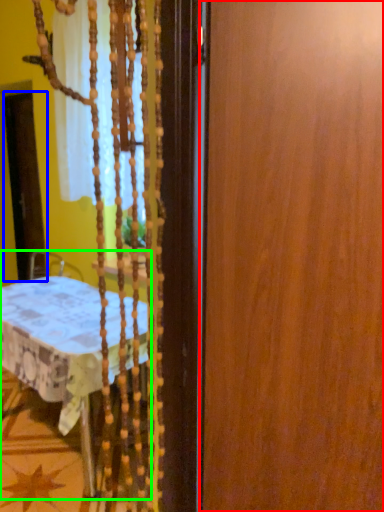
Question: Based on their relative distances, which object is farther from barn door (highlighted by a red box)? Choose from screen door (highlighted by a blue box) and furniture (highlighted by a green box).

Choices:
 (A) screen door
 (B) furniture

Answer: (A)